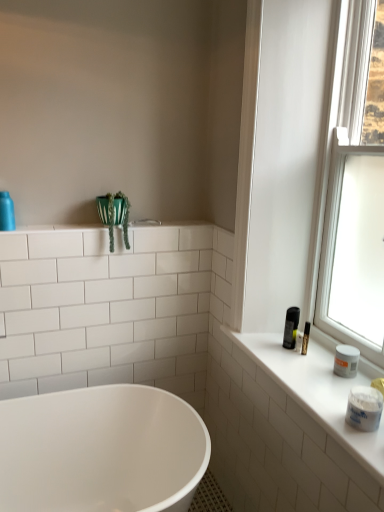
Question: Can you confirm if white matte counter top at right is taller than matte blue bottle at upper left, marked as the second toiletry in a bottom-to-top arrangement?

Choices:
 (A) yes
 (B) no

Answer: (B)

Question: From the image's perspective, is white matte counter top at right located beneath matte blue bottle at upper left, marked as the second toiletry in a bottom-to-top arrangement?

Choices:
 (A) yes
 (B) no

Answer: (A)

Question: Is white matte counter top at right thinner than matte blue bottle at upper left, the 2th toiletry from the front?

Choices:
 (A) no
 (B) yes

Answer: (A)

Question: Can you confirm if white matte counter top at right is wider than matte blue bottle at upper left, the first toiletry viewed from the top?

Choices:
 (A) no
 (B) yes

Answer: (B)

Question: Are white matte counter top at right and matte blue bottle at upper left, the first toiletry viewed from the top, far apart?

Choices:
 (A) no
 (B) yes

Answer: (B)

Question: Could you tell me if white matte counter top at right is facing matte blue bottle at upper left, which is the 1th toiletry from left to right?

Choices:
 (A) no
 (B) yes

Answer: (A)

Question: From a real-world perspective, is matte blue bottle at upper left, which appears as the 1th toiletry when viewed from the back, physically above transparent glass window at upper right?

Choices:
 (A) yes
 (B) no

Answer: (B)

Question: Considering the relative positions of matte blue bottle at upper left, marked as the second toiletry in a bottom-to-top arrangement, and transparent glass window at upper right in the image provided, is matte blue bottle at upper left, marked as the second toiletry in a bottom-to-top arrangement, behind transparent glass window at upper right?

Choices:
 (A) no
 (B) yes

Answer: (B)

Question: Is the position of matte blue bottle at upper left, the 2th toiletry from the front, less distant than that of transparent glass window at upper right?

Choices:
 (A) yes
 (B) no

Answer: (B)

Question: Considering the relative sizes of matte blue bottle at upper left, marked as the second toiletry in a bottom-to-top arrangement, and transparent glass window at upper right in the image provided, is matte blue bottle at upper left, marked as the second toiletry in a bottom-to-top arrangement, bigger than transparent glass window at upper right?

Choices:
 (A) no
 (B) yes

Answer: (A)

Question: Is matte blue bottle at upper left, the first toiletry viewed from the top, turned away from transparent glass window at upper right?

Choices:
 (A) no
 (B) yes

Answer: (A)

Question: Is matte blue bottle at upper left, which is counted as the second toiletry, starting from the right, smaller than transparent glass window at upper right?

Choices:
 (A) yes
 (B) no

Answer: (A)

Question: Is green fabric plant at upper left closer to the viewer compared to white matte jar at right, acting as the first toiletry starting from the right?

Choices:
 (A) yes
 (B) no

Answer: (B)